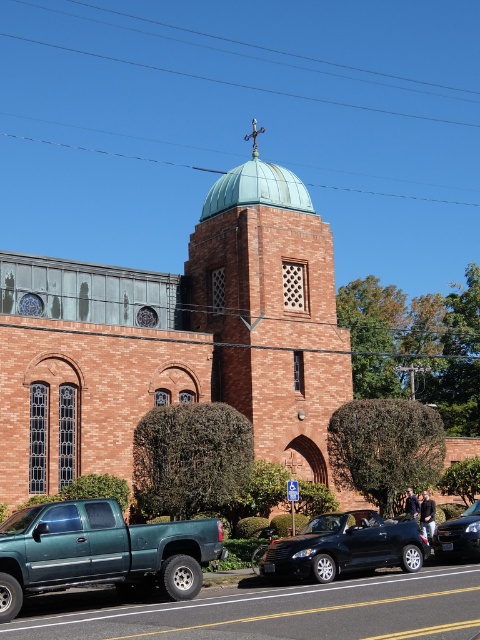
Question: Which object appears closest to the camera in this image?

Choices:
 (A) teal brick tower at center
 (B) teal matte dome at center

Answer: (A)

Question: Can you confirm if teal brick tower at center is positioned below teal matte dome at center?

Choices:
 (A) yes
 (B) no

Answer: (A)

Question: Estimate the real-world distances between objects in this image. Which object is farther from the black matte convertible at center?

Choices:
 (A) teal matte truck at lower left
 (B) brick church at center
 (C) teal brick tower at center
 (D) teal matte dome at center

Answer: (D)

Question: Is brick church at center thinner than teal matte truck at lower left?

Choices:
 (A) no
 (B) yes

Answer: (A)

Question: Among these points, which one is nearest to the camera?

Choices:
 (A) (294, 179)
 (B) (447, 529)
 (C) (417, 531)
 (D) (168, 536)

Answer: (D)

Question: Can you confirm if brick church at center is positioned below teal matte dome at center?

Choices:
 (A) yes
 (B) no

Answer: (A)